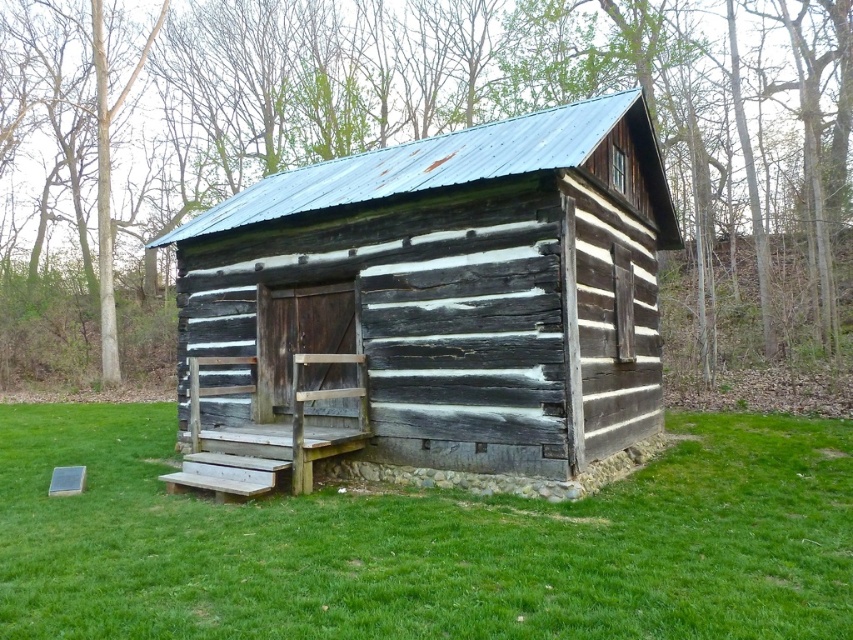
You are standing on the porch of the weathered wood cabin at center and looking down at the green grass at lower center. Which object appears narrower from your perspective?

The weathered wood cabin at center appears narrower than the green grass at lower center from your perspective.

You are standing at the point marked by coordinates point (x=437, y=308) in the image of the rustic log cabin. What object are you directly at?

You are directly at the weathered wood cabin at center marked by point (x=437, y=308).

You are standing in front of the rustic log cabin and want to determine which of the two points, point [242,422] or point [363,579], is closer to you. Based on the cabin structure, which point is nearer?

Point [242,422] is closer to you because it is further to the viewer than point [363,579].